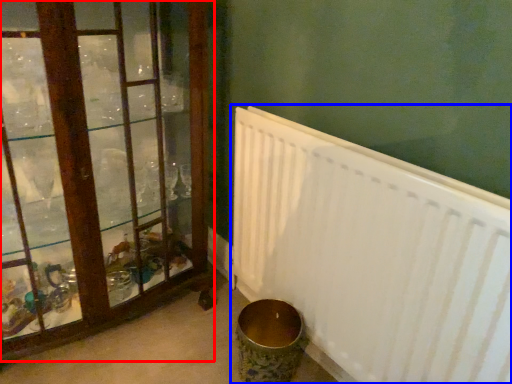
Question: Which point is further to the camera, window (highlighted by a red box) or radiator (highlighted by a blue box)?

Choices:
 (A) window
 (B) radiator

Answer: (A)